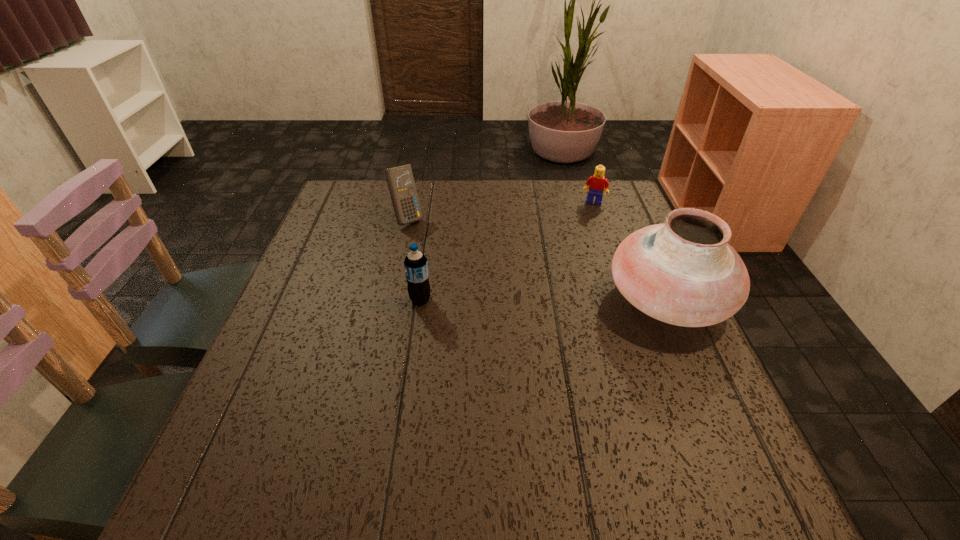
I want to click on free space located 0.300m on the front-facing side of the calculator, so click(487, 285).

The image size is (960, 540). I want to click on free point located 0.130m on the front-facing side of the calculator, so click(x=444, y=251).

Locate an element on the screen. The height and width of the screenshot is (540, 960). vacant space positioned on the front-facing side of the calculator is located at coordinates (435, 244).

I want to click on Lego that is at the far edge, so click(x=597, y=183).

This screenshot has height=540, width=960. In order to click on calculator that is positioned at the far edge in this screenshot , I will do 400,180.

This screenshot has width=960, height=540. Identify the location of pottery that is at the right edge. (683, 272).

You are a GUI agent. You are given a task and a screenshot of the screen. Output one action in this format:
    pyautogui.click(x=<x>, y=<y>)
    Task: Click on the Lego that is at the right edge
    
    Given the screenshot: What is the action you would take?
    pyautogui.click(x=597, y=183)

Where is `object present at the far right corner`? Image resolution: width=960 pixels, height=540 pixels. object present at the far right corner is located at coordinates pos(597,183).

In the image, there is a desktop. Where is `vacant space at the far edge`? The width and height of the screenshot is (960, 540). vacant space at the far edge is located at coordinates (386, 202).

The height and width of the screenshot is (540, 960). Identify the location of vacant region at the near edge of the desktop. tap(618, 447).